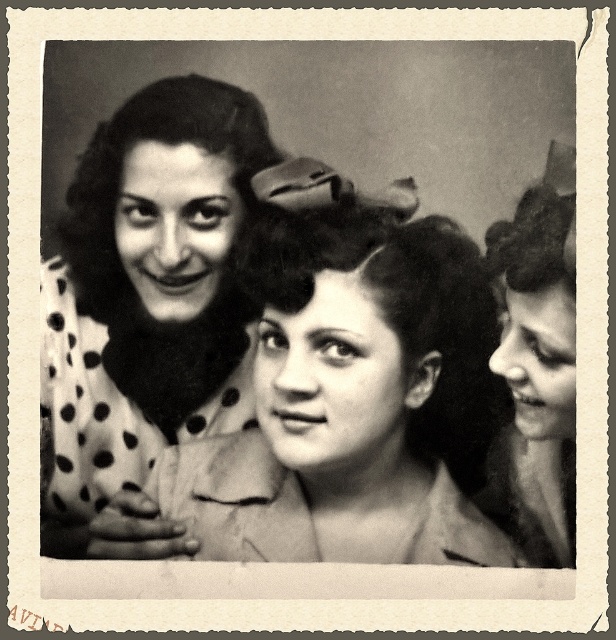
In the vintage photograph, you notice two distinct elements in the scene. One is the polka dot fabric at center and the other is the smooth skin face at right. From an observer standing in front of the image, which of these two elements appears larger in height?

The polka dot fabric at center appears much taller than the smooth skin face at right in the image.

Looking at the vintage photograph of the three women, can you determine if the polka dot fabric at center is positioned higher than the curly dark hair at center?

Yes, the polka dot fabric at center is located above curly dark hair at center, so it is positioned higher.

Based on the scene described, which object is smaller in size between the polka dot fabric at center and the curly dark hair at center?

The polka dot fabric at center has a smaller size compared to the curly dark hair at center, so the polka dot fabric at center is smaller.